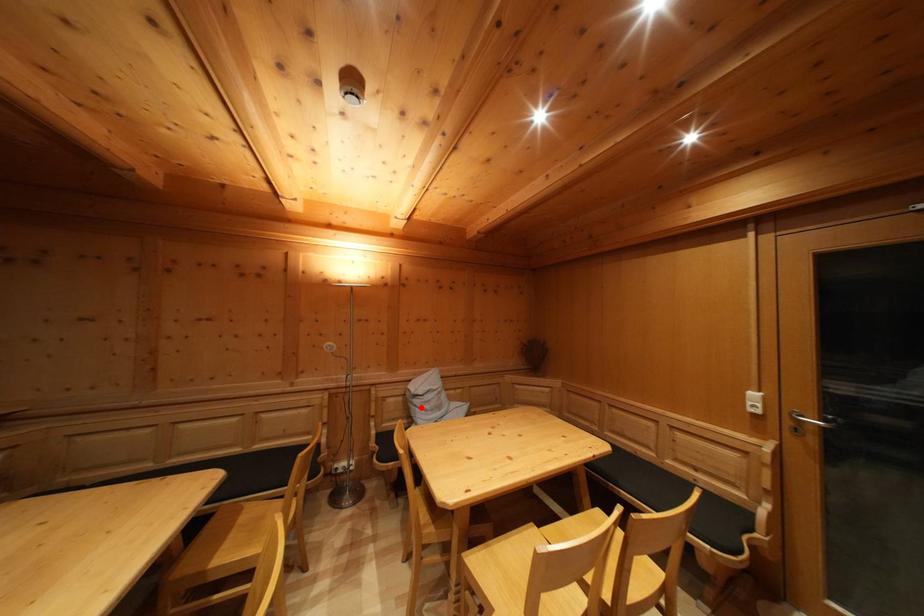
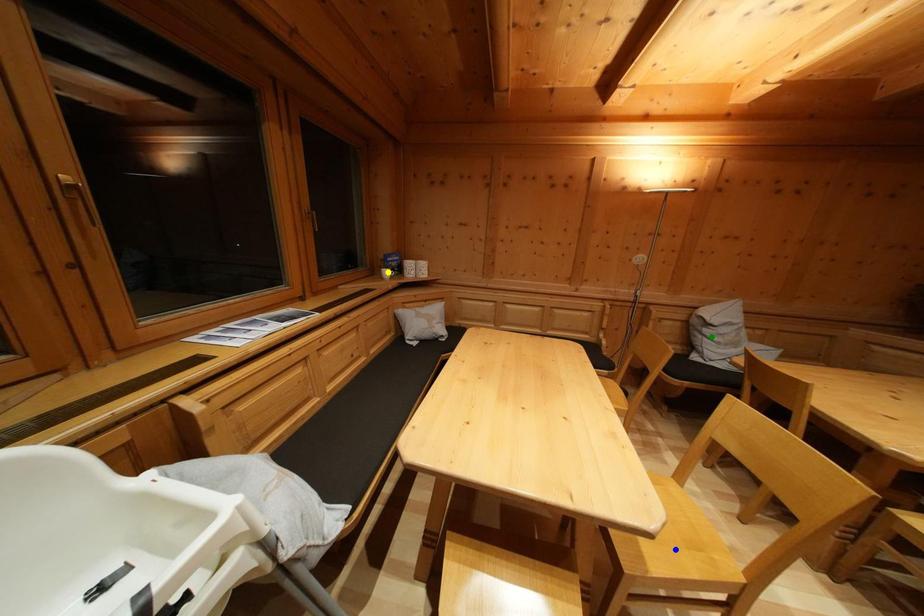
Question: I am providing you with two images of the same scene from different viewpoints. A red point is marked on the first image. You are given multiple points on the second image. Can you choose the point in image 2 that corresponds to the point in image 1?

Choices:
 (A) green point
 (B) yellow point
 (C) blue point

Answer: (A)